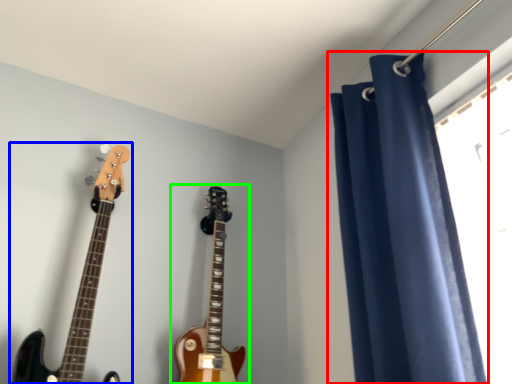
Question: Which is farther away from curtain (highlighted by a red box)? guitar (highlighted by a blue box) or guitar (highlighted by a green box)?

Choices:
 (A) guitar
 (B) guitar

Answer: (A)